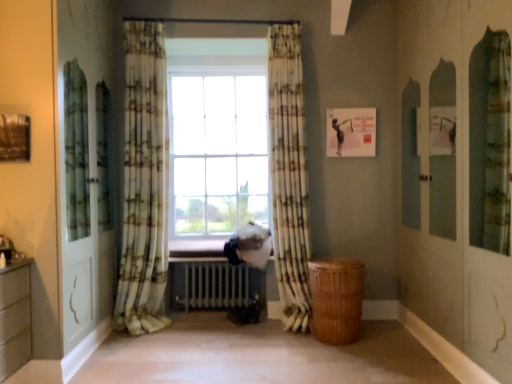
Question: Does printed fabric curtain at center, the 1th curtain when ordered from left to right, have a larger size compared to white metallic radiator at center?

Choices:
 (A) no
 (B) yes

Answer: (B)

Question: Does printed fabric curtain at center, the 1th curtain when ordered from left to right, have a lesser height compared to white metallic radiator at center?

Choices:
 (A) yes
 (B) no

Answer: (B)

Question: Is printed fabric curtain at center, which appears as the 2th curtain when viewed from the right, wider than white metallic radiator at center?

Choices:
 (A) no
 (B) yes

Answer: (A)

Question: Is printed fabric curtain at center, which appears as the 2th curtain when viewed from the right, facing away from white metallic radiator at center?

Choices:
 (A) no
 (B) yes

Answer: (A)

Question: Is printed fabric curtain at center, which appears as the 2th curtain when viewed from the right, aimed at white metallic radiator at center?

Choices:
 (A) no
 (B) yes

Answer: (A)

Question: In the image, is white metallic radiator at center on the left side or the right side of printed fabric curtain at center, the 1th curtain when ordered from left to right?

Choices:
 (A) left
 (B) right

Answer: (B)

Question: From a real-world perspective, is white metallic radiator at center physically located above or below printed fabric curtain at center, the 1th curtain when ordered from left to right?

Choices:
 (A) below
 (B) above

Answer: (A)

Question: In the image, is white metallic radiator at center positioned in front of or behind printed fabric curtain at center, the 1th curtain when ordered from left to right?

Choices:
 (A) front
 (B) behind

Answer: (B)

Question: In terms of size, does white metallic radiator at center appear bigger or smaller than printed fabric curtain at center, which appears as the 2th curtain when viewed from the right?

Choices:
 (A) big
 (B) small

Answer: (B)

Question: Would you say printed fabric curtain at center, the 1th curtain when ordered from left to right, is to the left or to the right of printed fabric curtain at center, which appears as the first curtain when viewed from the right, in the picture?

Choices:
 (A) left
 (B) right

Answer: (A)

Question: Is printed fabric curtain at center, the 1th curtain when ordered from left to right, wider or thinner than printed fabric curtain at center, which appears as the first curtain when viewed from the right?

Choices:
 (A) thin
 (B) wide

Answer: (A)

Question: Considering their positions, is printed fabric curtain at center, the 1th curtain when ordered from left to right, located in front of or behind printed fabric curtain at center, which ranks as the 2th curtain in left-to-right order?

Choices:
 (A) behind
 (B) front

Answer: (B)

Question: Does point (134, 36) appear closer or farther from the camera than point (279, 92)?

Choices:
 (A) farther
 (B) closer

Answer: (B)

Question: From a real-world perspective, is printed fabric curtain at center, which ranks as the 2th curtain in left-to-right order, physically located above or below printed fabric curtain at center, which appears as the 2th curtain when viewed from the right?

Choices:
 (A) below
 (B) above

Answer: (A)

Question: Considering the positions of printed fabric curtain at center, which appears as the first curtain when viewed from the right, and printed fabric curtain at center, the 1th curtain when ordered from left to right, in the image, is printed fabric curtain at center, which appears as the first curtain when viewed from the right, bigger or smaller than printed fabric curtain at center, the 1th curtain when ordered from left to right,?

Choices:
 (A) small
 (B) big

Answer: (A)